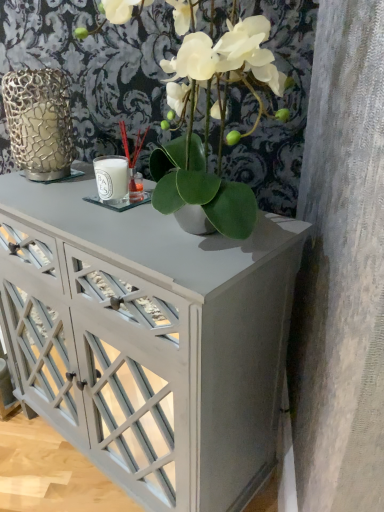
Identify the location of free area below green matte plant at center (from a real-world perspective). The height and width of the screenshot is (512, 384). (185, 236).